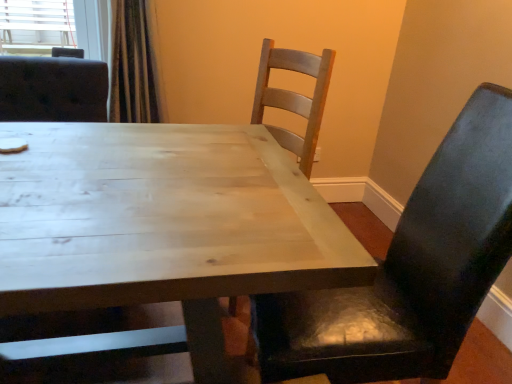
Question: Based on their positions, is matte black chair at right located to the left or right of light wood table at center?

Choices:
 (A) right
 (B) left

Answer: (A)

Question: From a real-world perspective, is matte black chair at right above or below light wood table at center?

Choices:
 (A) below
 (B) above

Answer: (B)

Question: From the image's perspective, is matte black chair at right above or below light wood table at center?

Choices:
 (A) below
 (B) above

Answer: (B)

Question: From the image's perspective, is light wood table at center positioned above or below matte black chair at right?

Choices:
 (A) above
 (B) below

Answer: (B)

Question: Is light wood table at center in front of or behind matte black chair at right in the image?

Choices:
 (A) front
 (B) behind

Answer: (A)

Question: Does point (101, 221) appear closer or farther from the camera than point (432, 332)?

Choices:
 (A) farther
 (B) closer

Answer: (B)

Question: Is light wood table at center situated inside matte black chair at right or outside?

Choices:
 (A) inside
 (B) outside

Answer: (B)